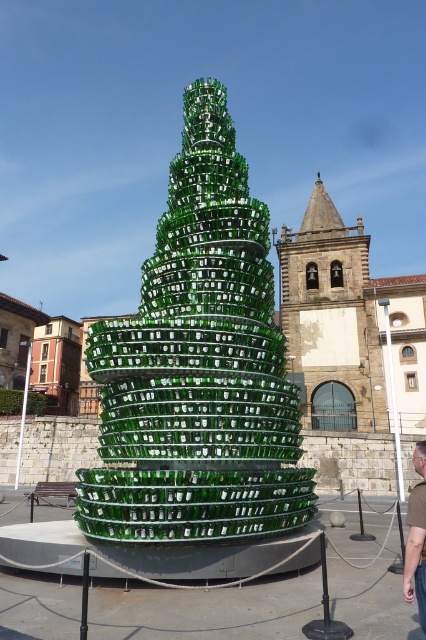
You are standing in front of a historic building with a point marked on the ground. The point is at coordinates (198,365). Based on the scene description, what object is located at that point?

The point at coordinates (198,365) indicates the location of the green glass Christmas tree at center.

You are standing in front of the sculpture and want to take a photo of the green glass christmas tree at center. Where should you position yourself to capture it in the frame?

The green glass christmas tree at center is located at point (198, 365), so you should position yourself directly in front of it to capture it in the frame.

You are an artist planning to install a new sculpture in the same area as the green glass christmas tree at center and the green glass bottle at lower right. The new sculpture will be 50 feet long. Considering the space between the existing sculptures, will there be enough room to place it without overlapping?

The distance between the green glass christmas tree at center and the green glass bottle at lower right is 42.83 feet. Since the new sculpture is 50 feet long, it would require more space than what is currently available between them. Therefore, there isn